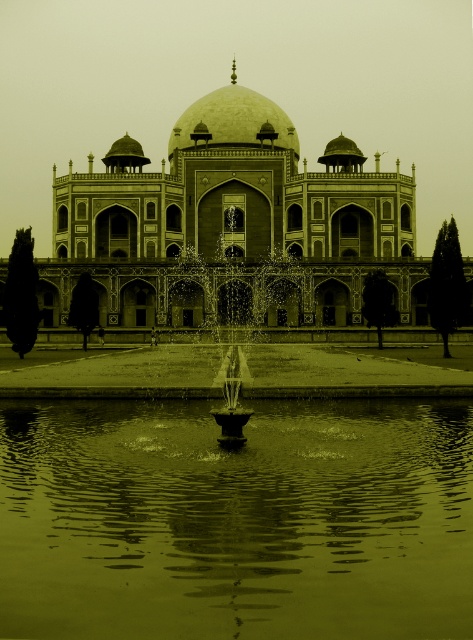
You are an architect visiting the site of the sepia stone palace at center and the smooth stone fountain at center. You need to determine if the fountain is directly beneath the palace. Based on the scene, can you confirm this?

The sepia stone palace at center is positioned over the smooth stone fountain at center, so yes, the fountain is directly beneath the palace.

You are standing in front of the grand building with its central dome and reflecting pool. You notice two points marked in the scene. Which of the two points, point (x=324, y=436) or point (x=332, y=298), is closer to you?

Point (x=324, y=436) is closer to the viewer than point (x=332, y=298).

Looking at this image, you are standing in front of the sepia stone palace at center and want to see your reflection in the green reflective water at center. Can you see your reflection clearly in the water?

The green reflective water at center has a lesser height compared to the sepia stone palace at center, so yes, you can see your reflection clearly in the water since the water is lower and acts as a reflective surface.